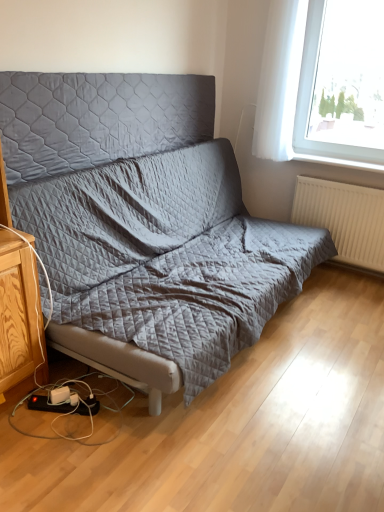
Question: Looking at their shapes, would you say black plastic power strip at lower left is wider or thinner than transparent glass window at upper right?

Choices:
 (A) thin
 (B) wide

Answer: (B)

Question: Is black plastic power strip at lower left inside the boundaries of transparent glass window at upper right, or outside?

Choices:
 (A) inside
 (B) outside

Answer: (B)

Question: Which object is positioned farthest from the black plastic power strip at lower left?

Choices:
 (A) white textured radiator at right
 (B) transparent glass window at upper right
 (C) quilted fabric headboard at upper center
 (D) white sheer curtain at upper right
 (E) quilted fabric studio couch at center

Answer: (B)

Question: Based on their relative distances, which object is nearer to the black plastic power strip at lower left?

Choices:
 (A) white sheer curtain at upper right
 (B) transparent glass window at upper right
 (C) white textured radiator at right
 (D) quilted fabric studio couch at center
 (E) quilted fabric headboard at upper center

Answer: (D)